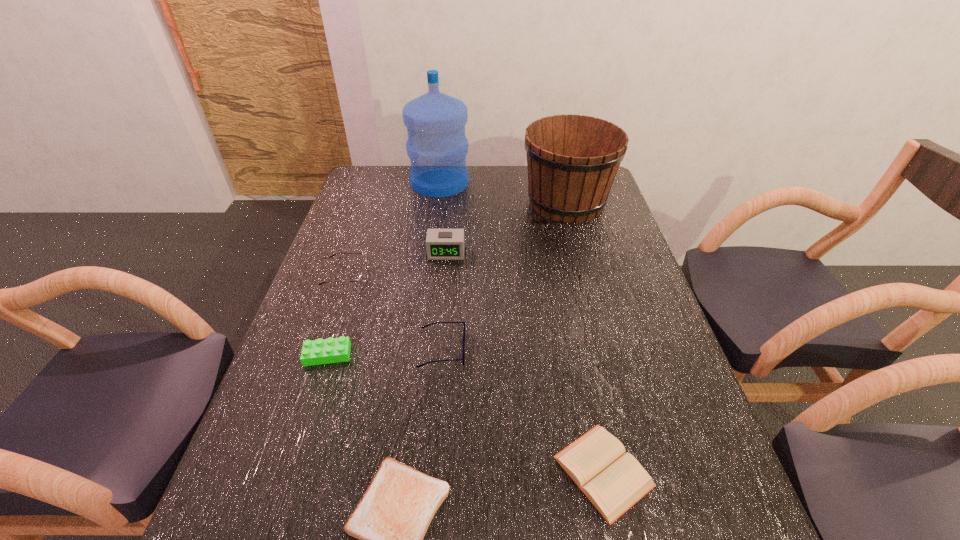
What are the coordinates of `water jug` in the screenshot? It's located at (437, 146).

Where is `wine bucket`? This screenshot has height=540, width=960. wine bucket is located at coordinates (572, 160).

In order to click on alarm clock in this screenshot , I will do `click(441, 244)`.

What are the coordinates of `the sixth shortest object` in the screenshot? It's located at (441, 244).

Locate an element on the screen. the left spectacles is located at coordinates (362, 278).

The height and width of the screenshot is (540, 960). I want to click on the farther spectacles, so click(362, 278).

Identify the location of the right spectacles. (463, 355).

Where is `Lego`? This screenshot has height=540, width=960. Lego is located at coordinates (331, 350).

Locate an element on the screen. diary is located at coordinates (613, 481).

The width and height of the screenshot is (960, 540). I want to click on vacant region located 0.070m on the left of the tallest object, so click(392, 183).